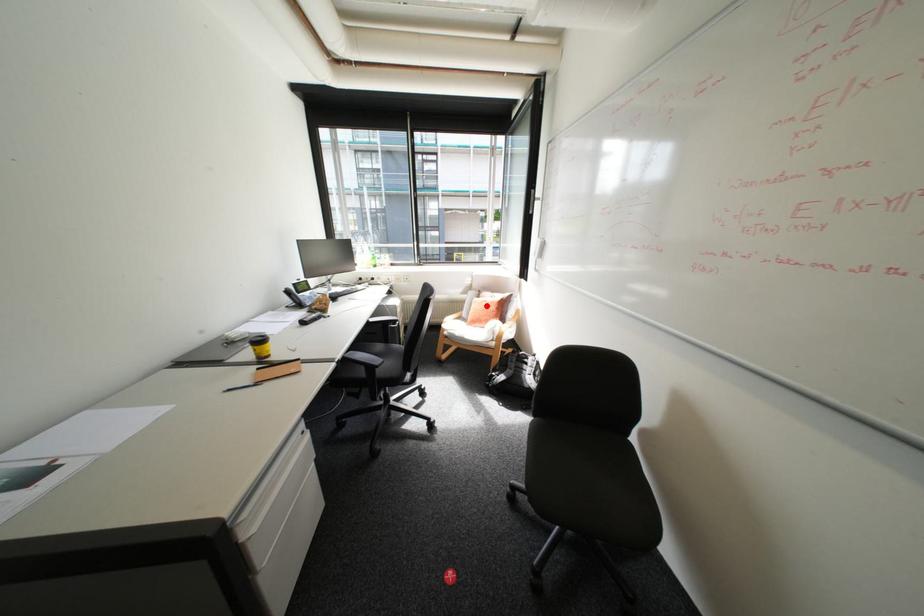
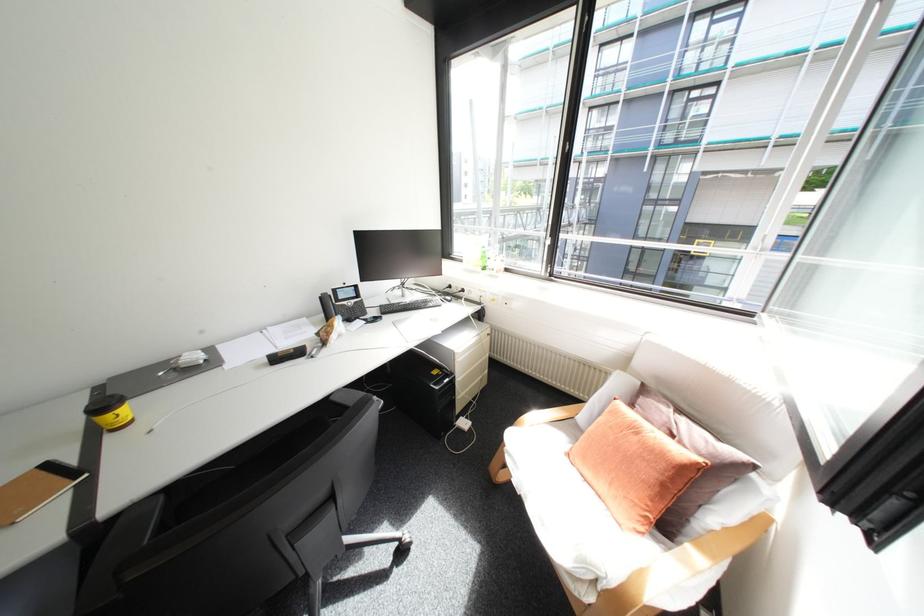
Find the pixel in the second image that matches the highlighted location in the first image.

(621, 428)